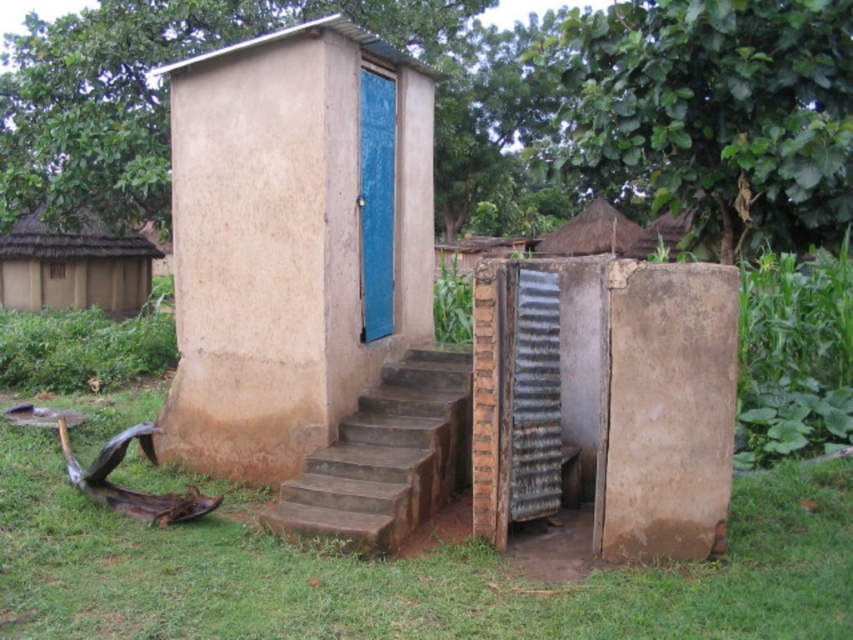
Question: Which of these objects is positioned farthest from the matte clay hut at center?

Choices:
 (A) green grass at lower center
 (B) blue textured door at center
 (C) thatched roof hut at upper left

Answer: (C)

Question: Is matte clay hut at center below blue textured door at center?

Choices:
 (A) yes
 (B) no

Answer: (A)

Question: Which is farther from the thatched roof hut at upper left?

Choices:
 (A) blue textured door at center
 (B) green grass at lower center
 (C) brown concrete stairs at center
 (D) thatched straw hut at center

Answer: (B)

Question: Among these objects, which one is farthest from the camera?

Choices:
 (A) brown concrete stairs at center
 (B) matte clay hut at center
 (C) green grass at lower center
 (D) blue textured door at center

Answer: (D)

Question: Is matte clay hut at center to the right of thatched roof hut at upper left from the viewer's perspective?

Choices:
 (A) no
 (B) yes

Answer: (B)

Question: Does brown concrete stairs at center appear under thatched straw hut at center?

Choices:
 (A) no
 (B) yes

Answer: (B)